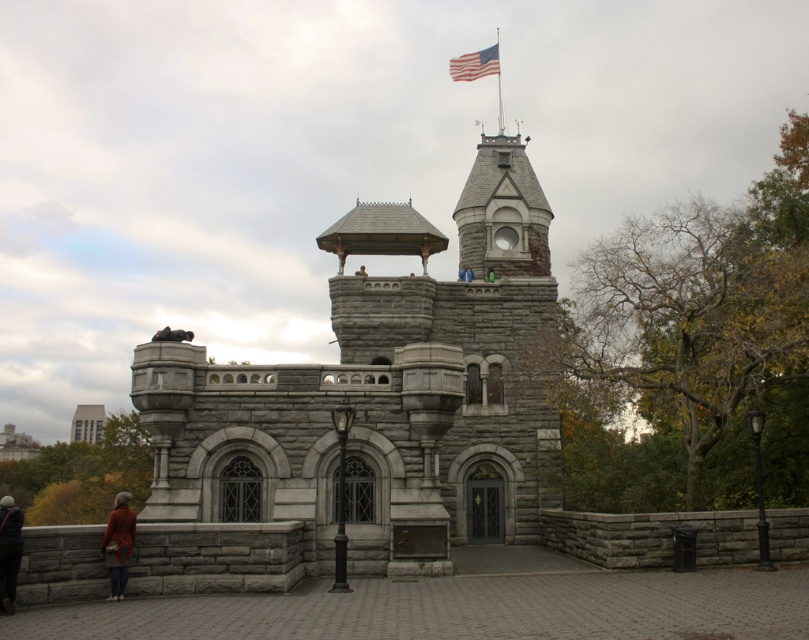
You are standing in the park and see both the brown woolen hat at lower left and the gray stone tower at lower left. Which object is closer to you?

The brown woolen hat at lower left is closer to you because it is in front of the gray stone tower at lower left.

You are standing at the center of the park and see the brown woolen hat at lower left and the gray stone tower at lower left. If you want to pick up the hat without getting too close to the tower, can you reach it safely? The park has a clear path between them.

The brown woolen hat at lower left and gray stone tower at lower left are 21.68 meters apart. Since the distance is quite large, you can safely reach the hat without getting too close to the tower as there is sufficient space between them.